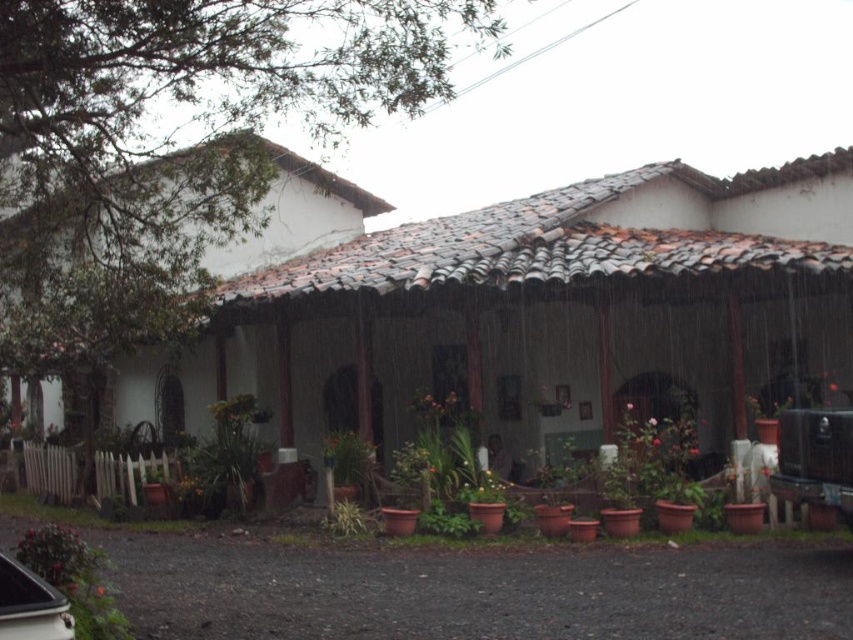
From the picture: Is green matte plant at lower left to the right of green leafy plant at center from the viewer's perspective?

Incorrect, green matte plant at lower left is not on the right side of green leafy plant at center.

Is green matte plant at lower left wider than green leafy plant at center?

Yes.

Between point (108, 566) and point (350, 483), which one is positioned in front?

Point (108, 566)

This screenshot has width=853, height=640. Find the location of `green matte plant at lower left`. green matte plant at lower left is located at coordinates (74, 579).

Who is taller, green leafy plant at lower left or green leafy plant at lower center?

Standing taller between the two is green leafy plant at lower left.

Who is more forward, (253,428) or (357,531)?

Point (357,531) is in front.

The image size is (853, 640). I want to click on green leafy plant at lower left, so click(224, 458).

Is green leafy plant at center wider than green leafy plant at lower center?

Yes.

How far apart are green leafy plant at center and green leafy plant at lower center?

24.00 inches

Does point (352, 435) come farther from viewer compared to point (354, 508)?

Yes, it is behind point (354, 508).

Find the location of a particular element. Image resolution: width=853 pixels, height=640 pixels. green leafy plant at center is located at coordinates (347, 458).